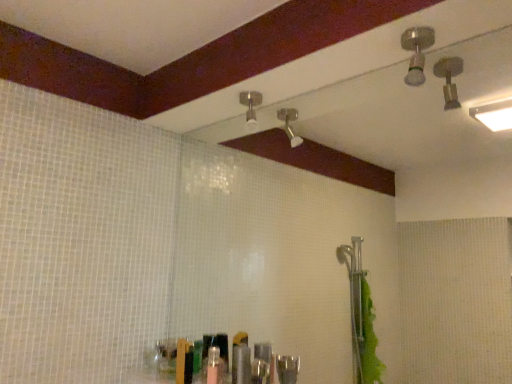
Question: Is metallic silver toiletries at center in front of matte silver shower head at upper center, the 2th shower positioned from the right?

Choices:
 (A) yes
 (B) no

Answer: (A)

Question: Is metallic silver toiletries at center thinner than matte silver shower head at upper center, the 2th shower positioned from the right?

Choices:
 (A) no
 (B) yes

Answer: (B)

Question: Considering the relative sizes of metallic silver toiletries at center and matte silver shower head at upper center, the 2th shower positioned from the right, in the image provided, is metallic silver toiletries at center shorter than matte silver shower head at upper center, the 2th shower positioned from the right,?

Choices:
 (A) no
 (B) yes

Answer: (A)

Question: Considering the relative sizes of metallic silver toiletries at center and matte silver shower head at upper center, the 2th shower positioned from the right, in the image provided, is metallic silver toiletries at center smaller than matte silver shower head at upper center, the 2th shower positioned from the right,?

Choices:
 (A) yes
 (B) no

Answer: (A)

Question: From the image's perspective, is metallic silver toiletries at center on top of matte silver shower head at upper center, which appears as the 1th shower when viewed from the back?

Choices:
 (A) yes
 (B) no

Answer: (B)

Question: Is metallic silver toiletries at center positioned behind matte silver shower head at upper center, the 1th shower from the left?

Choices:
 (A) yes
 (B) no

Answer: (B)

Question: Is matte silver shower head at upper center, the 2th shower in the front-to-back sequence, completely or partially outside of brushed metal shower head at upper right, acting as the first shower starting from the right?

Choices:
 (A) yes
 (B) no

Answer: (A)

Question: Can you confirm if matte silver shower head at upper center, the 1th shower from the left, is bigger than brushed metal shower head at upper right, acting as the 2th shower starting from the left?

Choices:
 (A) no
 (B) yes

Answer: (B)

Question: Can you confirm if matte silver shower head at upper center, the 2th shower in the front-to-back sequence, is smaller than brushed metal shower head at upper right, acting as the first shower starting from the right?

Choices:
 (A) yes
 (B) no

Answer: (B)

Question: From a real-world perspective, is matte silver shower head at upper center, the 1th shower from the left, on top of brushed metal shower head at upper right, marked as the 2th shower in a back-to-front arrangement?

Choices:
 (A) yes
 (B) no

Answer: (B)

Question: Does matte silver shower head at upper center, which appears as the 1th shower when viewed from the back, turn towards brushed metal shower head at upper right, acting as the first shower starting from the right?

Choices:
 (A) no
 (B) yes

Answer: (A)

Question: Is the depth of matte silver shower head at upper center, the 2th shower in the front-to-back sequence, greater than that of brushed metal shower head at upper right, marked as the 2th shower in a back-to-front arrangement?

Choices:
 (A) yes
 (B) no

Answer: (A)

Question: Can you confirm if brushed metal shower head at upper right, marked as the 2th shower in a back-to-front arrangement, is taller than metallic silver toiletries at center?

Choices:
 (A) no
 (B) yes

Answer: (A)